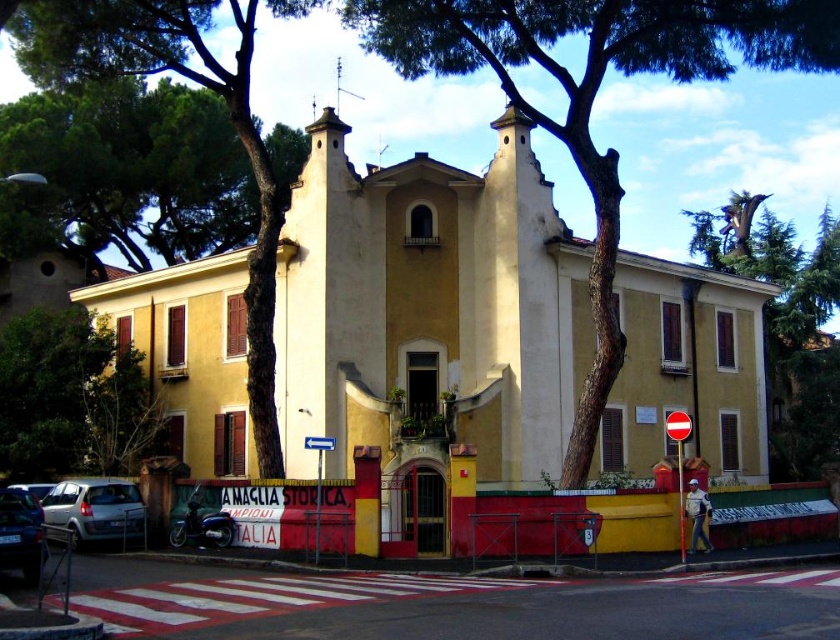
From the picture: You are standing in front of the two story building and see the green rough bark tree at center and the green leafy tree at upper left. Which tree is closer to you?

The green rough bark tree at center is closer to you because it is in front of the green leafy tree at upper left.

You are standing at the entrance of the two story building and want to take a photo of the green leafy tree at upper left. The camera you have can focus on objects up to 50 meters away. Will the camera be able to capture the tree clearly?

The green leafy tree at upper left and camera are 56.37 meters apart from each other. Since the camera can only focus up to 50 meters, it will not be able to capture the tree clearly.

You are a visitor standing at the entrance of the building and want to take a photo that includes both the green rough bark tree at center and the green leafy tree at upper left. Which tree should you frame closer to the bottom of the photo to ensure both are fully visible?

The green rough bark tree at center is shorter than the green leafy tree at upper left. To include both fully, frame the green rough bark tree at center closer to the bottom so its base is near the lower edge while the taller green leafy tree at upper left fits within the upper part of the photo.